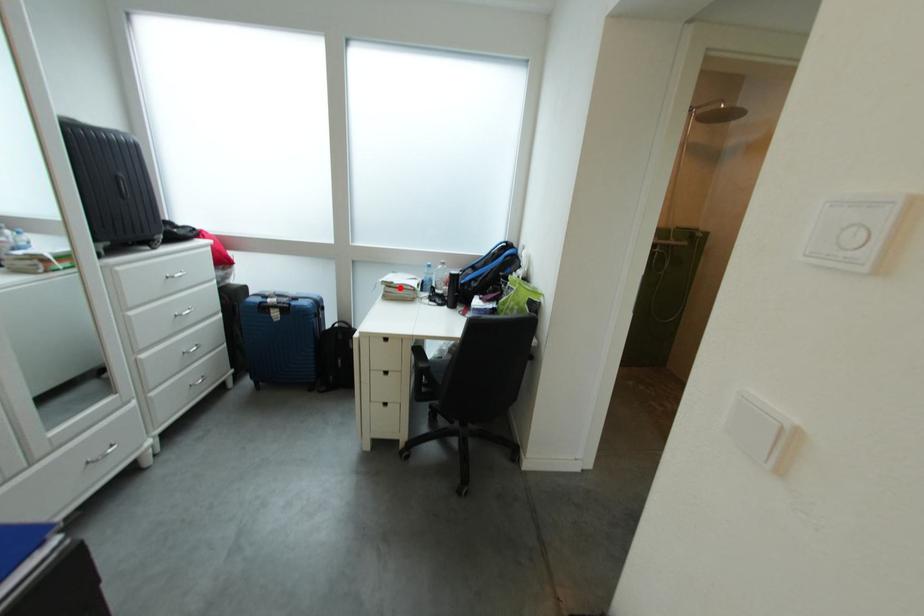
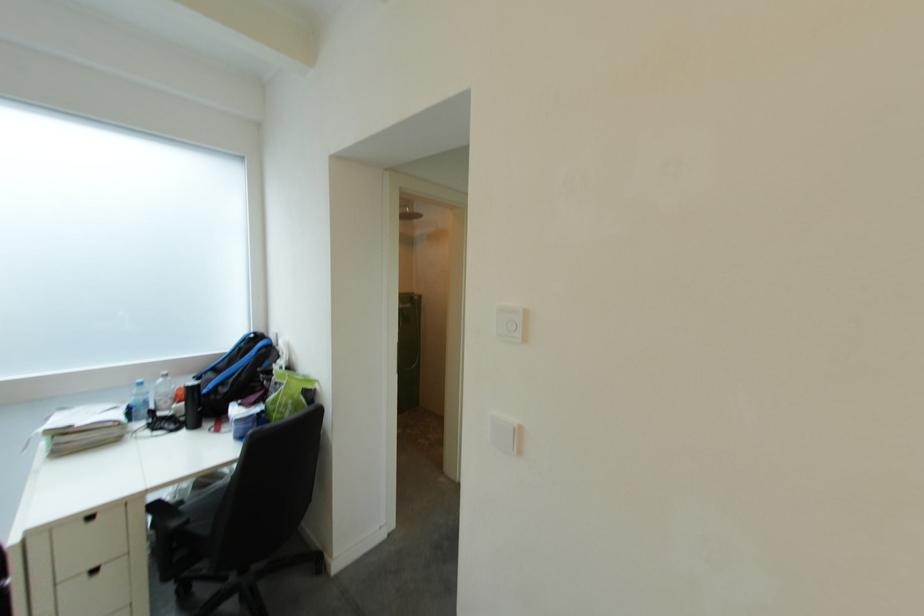
Question: I am providing you with two images of the same scene from different viewpoints. In image1, a red point is highlighted. Considering the same 3D point in image2, which of the following is correct?

Choices:
 (A) It is closer
 (B) It is farther

Answer: (A)